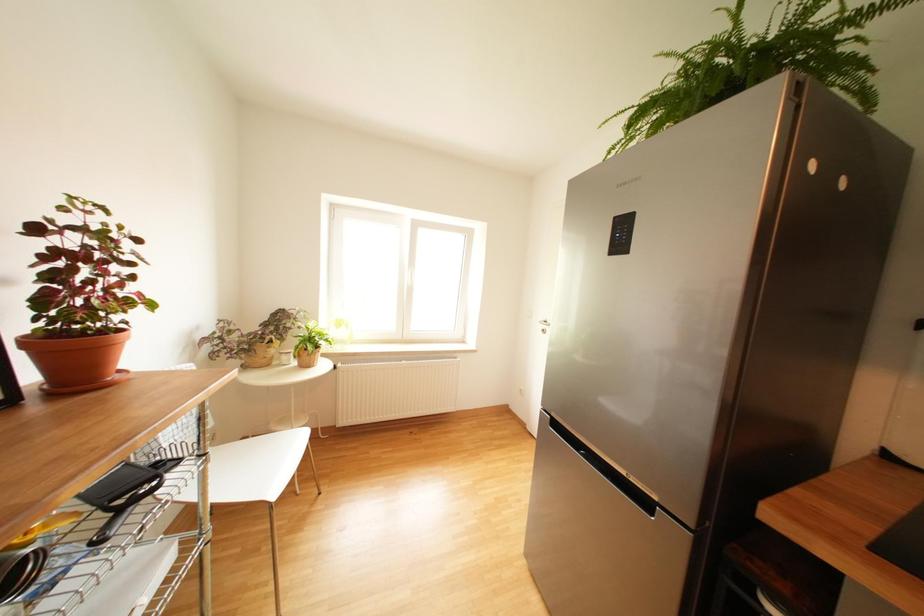
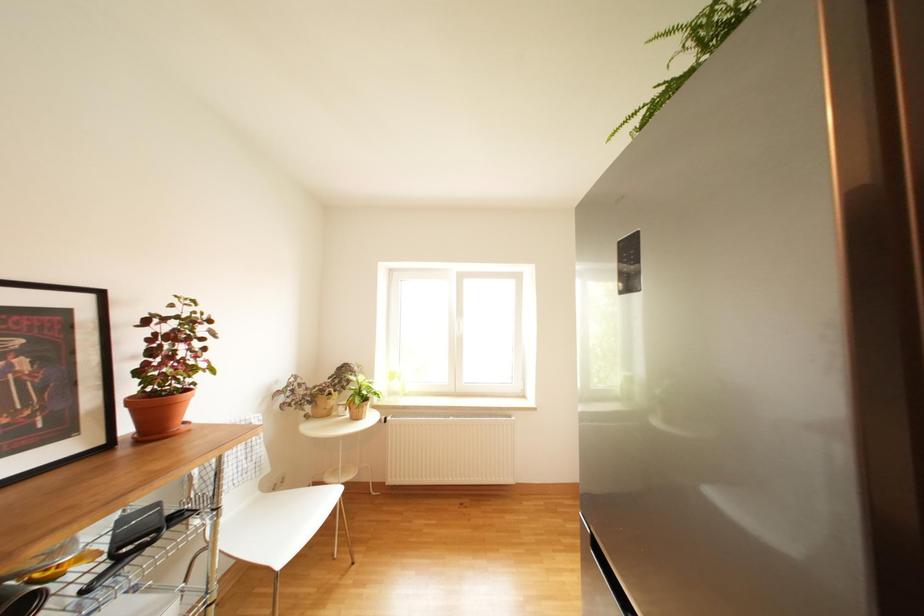
Which direction would the cameraman need to move to produce the second image?

The movement direction of the cameraman is right, forward.